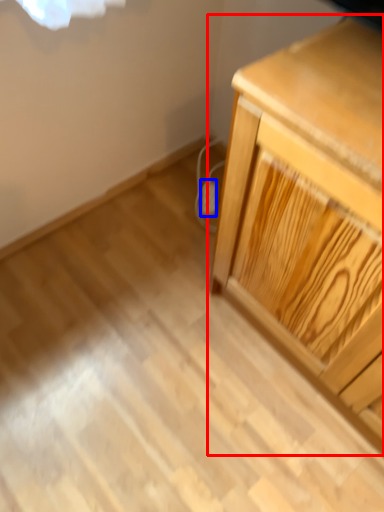
Question: Which of the following is the closest to the observer, chest of drawers (highlighted by a red box) or electric outlet (highlighted by a blue box)?

Choices:
 (A) chest of drawers
 (B) electric outlet

Answer: (A)